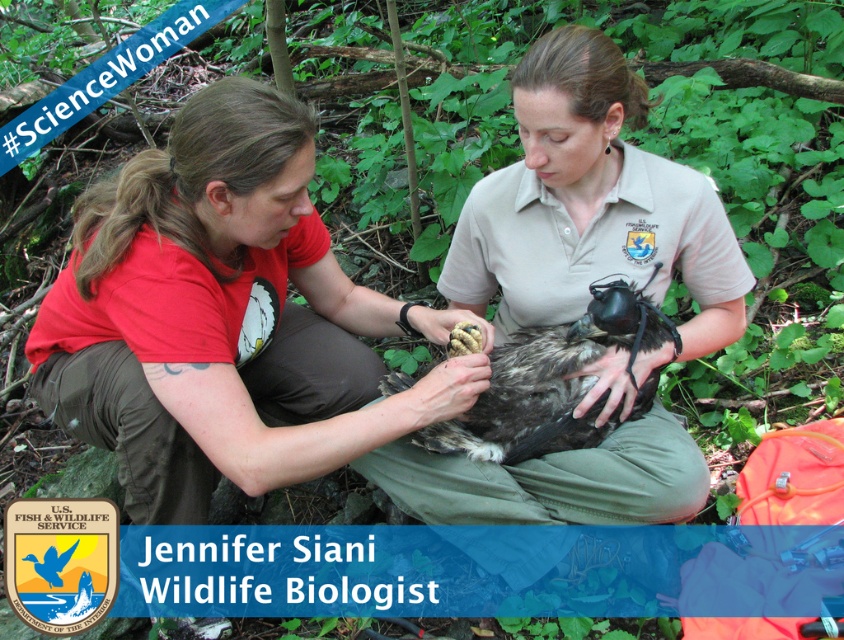
Image resolution: width=844 pixels, height=640 pixels. Describe the element at coordinates (590, 205) in the screenshot. I see `matte khaki shirt at center` at that location.

Image resolution: width=844 pixels, height=640 pixels. I want to click on matte khaki shirt at center, so click(590, 205).

How distant is matte red shirt at center from dark brown feathered eagle at center?

matte red shirt at center is 11.30 inches away from dark brown feathered eagle at center.

Between matte red shirt at center and dark brown feathered eagle at center, which one has less height?

With less height is dark brown feathered eagle at center.

Describe the element at coordinates (225, 317) in the screenshot. I see `matte red shirt at center` at that location.

Locate an element on the screen. The height and width of the screenshot is (640, 844). matte red shirt at center is located at coordinates (225, 317).

Who is shorter, matte red shirt at center or matte khaki shirt at center?

matte red shirt at center

Which is in front, point (138, 440) or point (479, 468)?

Positioned in front is point (138, 440).

In order to click on matte red shirt at center in this screenshot , I will do `click(225, 317)`.